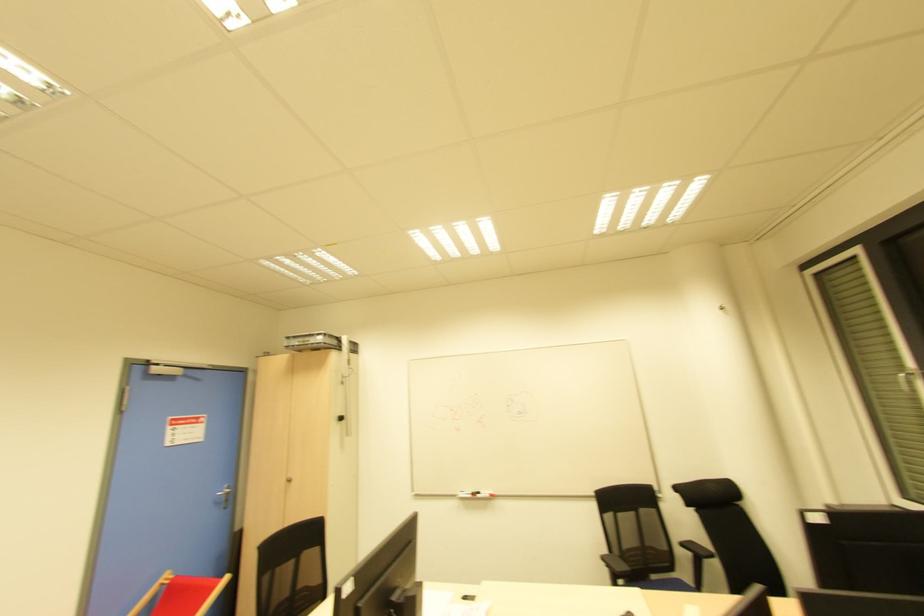
Locate an element on the screen. grey plastic box is located at coordinates (311, 342).